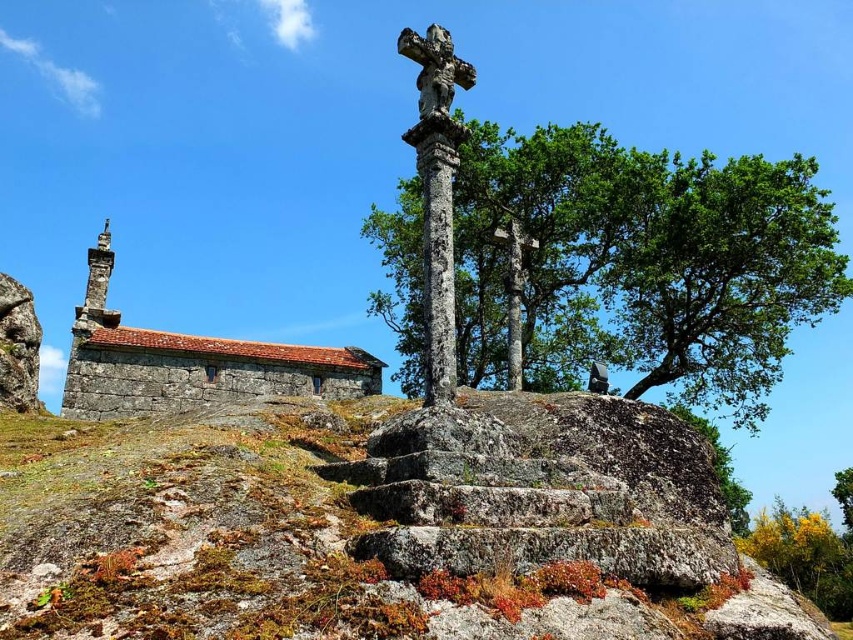
Does rusty stone steps at center have a smaller size compared to rustic stone church at left?

Yes, rusty stone steps at center is smaller than rustic stone church at left.

Can you confirm if rusty stone steps at center is positioned above rustic stone church at left?

No.

In order to click on rusty stone steps at center in this screenshot , I will do `click(386, 531)`.

Does point (236, 576) come closer to viewer compared to point (529, 147)?

Yes, point (236, 576) is closer to viewer.

Identify the location of rusty stone steps at center. (386, 531).

Does point (677, 214) come behind point (160, 369)?

That is True.

Which is behind, point (721, 180) or point (152, 337)?

Positioned behind is point (721, 180).

Identify the location of green rough bark tree at center. (641, 262).